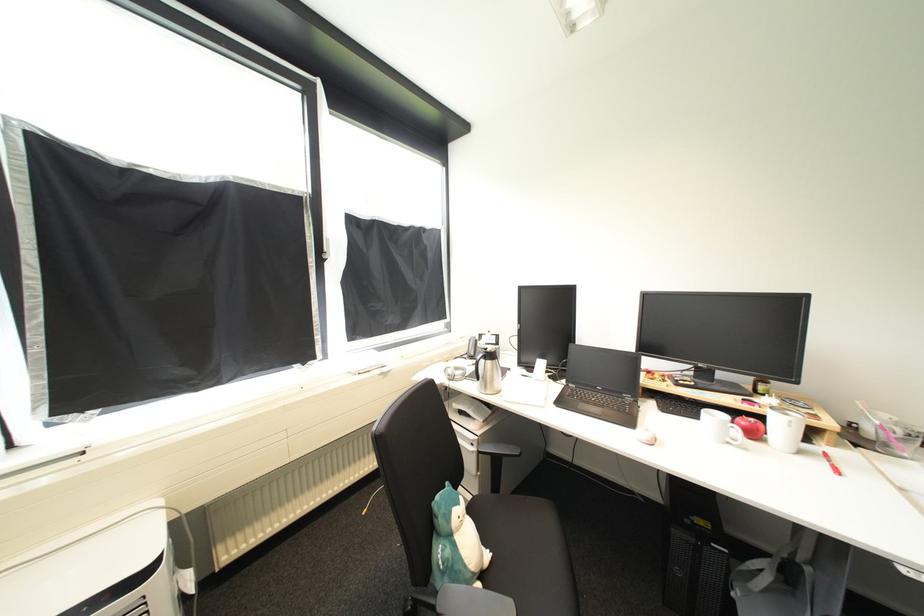
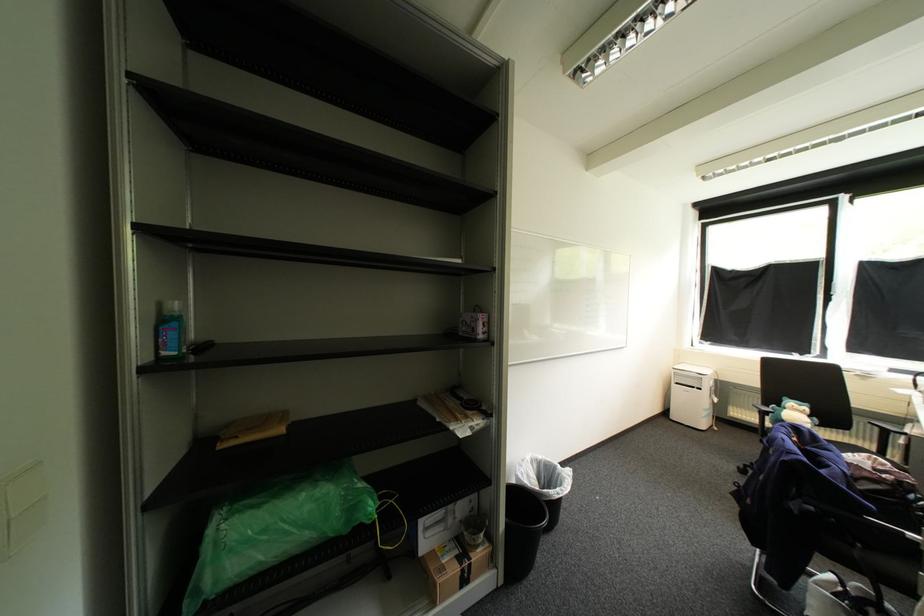
The point at [457,535] is marked in the first image. Where is the corresponding point in the second image?

(792, 408)